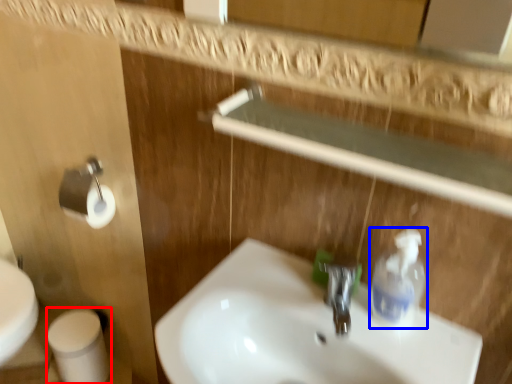
Question: Among these objects, which one is nearest to the camera, toilet paper (highlighted by a red box) or cleaning product (highlighted by a blue box)?

Choices:
 (A) toilet paper
 (B) cleaning product

Answer: (B)